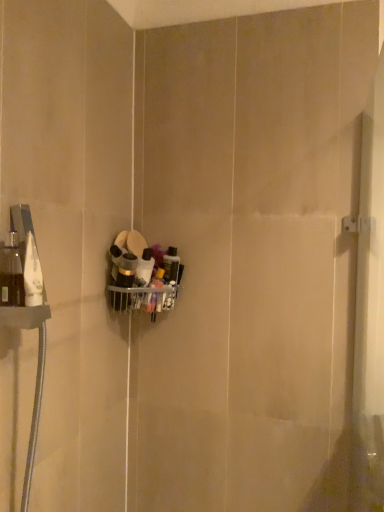
Question: Looking at their shapes, would you say translucent plastic bottles at center, the second toiletry when ordered from left to right, is wider or thinner than matte black container at center, the first toiletry when ordered from left to right?

Choices:
 (A) wide
 (B) thin

Answer: (B)

Question: From a real-world perspective, is translucent plastic bottles at center, the second toiletry when ordered from left to right, above or below matte black container at center, the first toiletry when ordered from left to right?

Choices:
 (A) above
 (B) below

Answer: (B)

Question: Is translucent plastic bottles at center, acting as the 1th toiletry starting from the right, taller or shorter than matte black container at center, which ranks as the 2th toiletry in right-to-left order?

Choices:
 (A) short
 (B) tall

Answer: (A)

Question: Do you think matte black container at center, the first toiletry when ordered from left to right, is within translucent plastic bottles at center, the second toiletry when ordered from left to right, or outside of it?

Choices:
 (A) inside
 (B) outside

Answer: (B)

Question: Considering the positions of point (120, 305) and point (140, 281), is point (120, 305) closer or farther from the camera than point (140, 281)?

Choices:
 (A) closer
 (B) farther

Answer: (B)

Question: Is matte black container at center, the first toiletry when ordered from left to right, in front of or behind translucent plastic bottles at center, acting as the 1th toiletry starting from the right, in the image?

Choices:
 (A) front
 (B) behind

Answer: (A)

Question: In terms of height, does matte black container at center, which ranks as the 2th toiletry in right-to-left order, look taller or shorter compared to translucent plastic bottles at center, acting as the 1th toiletry starting from the right?

Choices:
 (A) tall
 (B) short

Answer: (A)